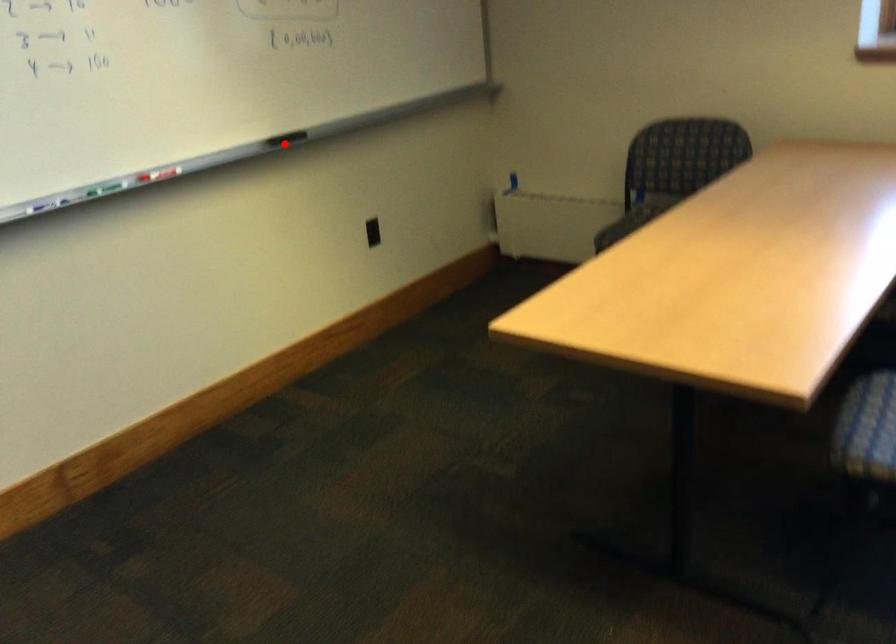
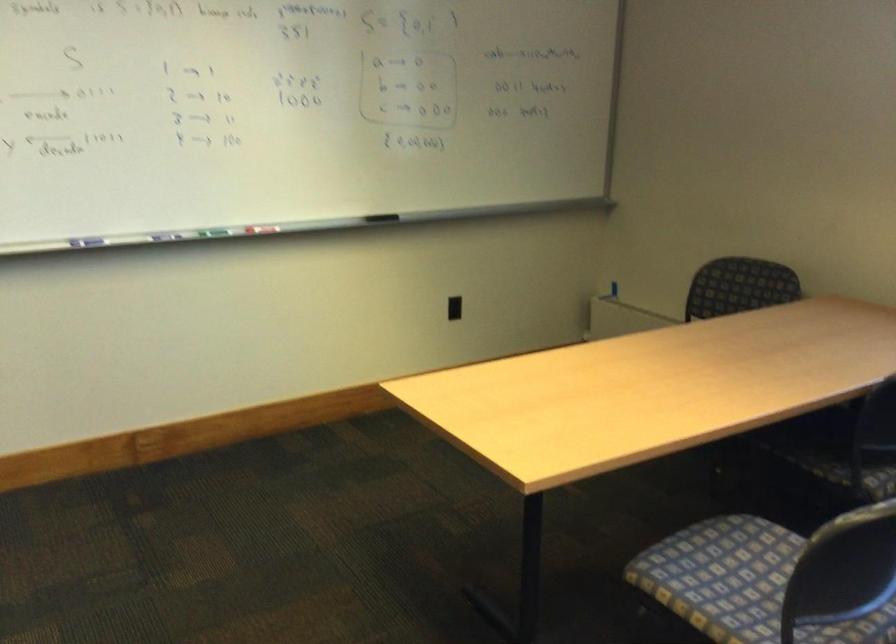
Question: I am providing you with two images of the same scene from different viewpoints. In image1, a red point is highlighted. Considering the same 3D point in image2, which of the following is correct?

Choices:
 (A) It is closer
 (B) It is farther

Answer: (B)